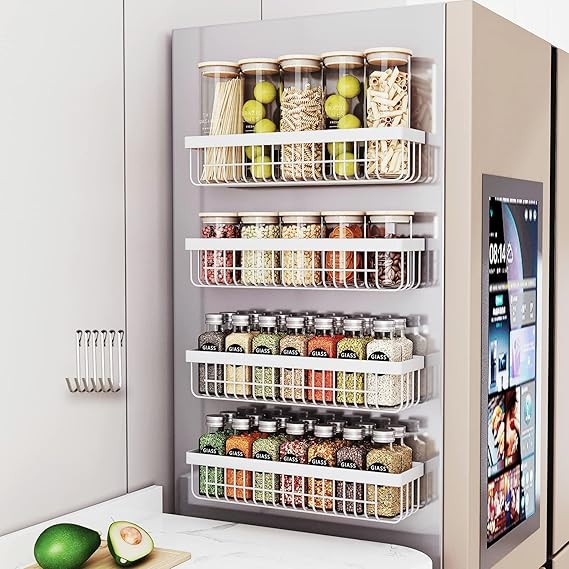
At what (x,y) coordinates should I click in order to perform the action: click on number of jars on the second shelf. Please return your answer as a coordinate pair (x, y). The height and width of the screenshot is (569, 569). Looking at the image, I should click on (391, 225), (337, 225), (296, 224), (259, 230), (220, 228).